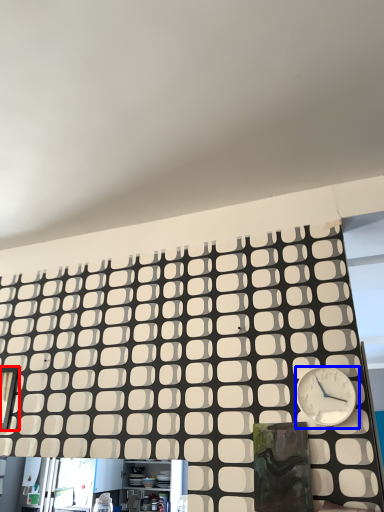
Question: Which point is further to the camera, window (highlighted by a red box) or wall clock (highlighted by a blue box)?

Choices:
 (A) window
 (B) wall clock

Answer: (A)